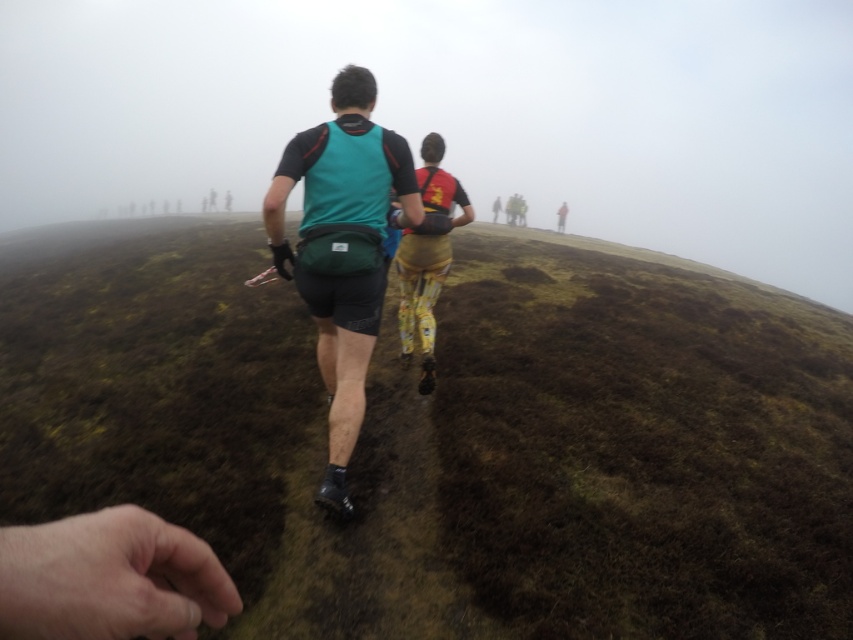
Question: Among these points, which one is nearest to the camera?

Choices:
 (A) (428, 369)
 (B) (341, 156)
 (C) (387, 596)

Answer: (C)

Question: Among these objects, which one is farthest from the camera?

Choices:
 (A) dark brown mossy ground at center
 (B) teal fabric backpack at center
 (C) yellow patterned pants at center

Answer: (C)

Question: Does dark brown mossy ground at center have a greater width compared to teal fabric backpack at center?

Choices:
 (A) yes
 (B) no

Answer: (A)

Question: Does dark brown mossy ground at center come in front of teal fabric backpack at center?

Choices:
 (A) yes
 (B) no

Answer: (A)

Question: Among these objects, which one is nearest to the camera?

Choices:
 (A) dark brown mossy ground at center
 (B) teal fabric backpack at center

Answer: (A)

Question: Is dark brown mossy ground at center further to the viewer compared to teal fabric backpack at center?

Choices:
 (A) yes
 (B) no

Answer: (B)